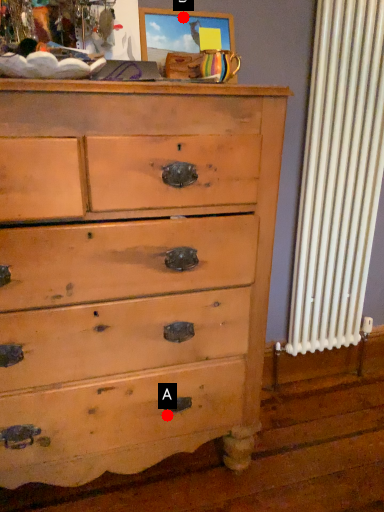
Question: Two points are circled on the image, labeled by A and B beside each circle. Among these points, which one is farthest from the camera?

Choices:
 (A) A is further
 (B) B is further

Answer: (B)